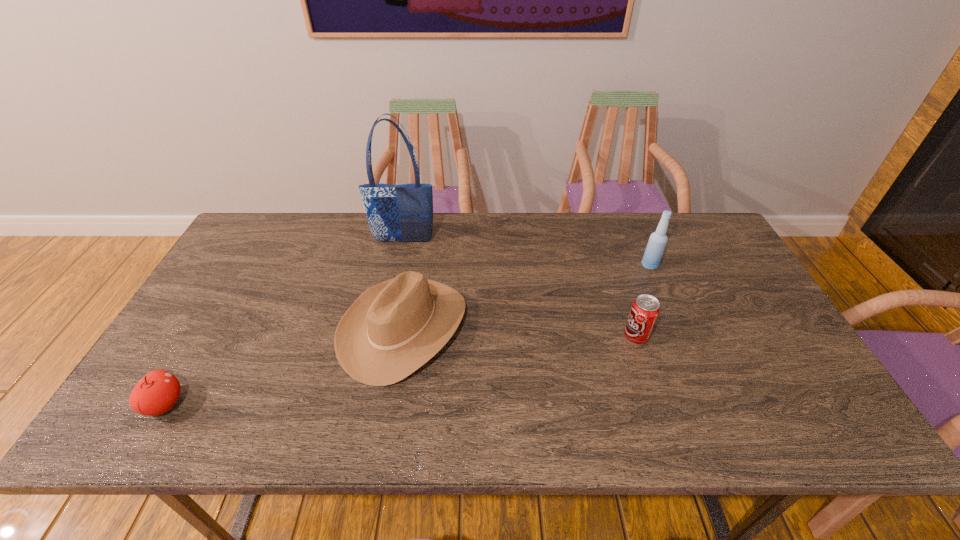
The width and height of the screenshot is (960, 540). Identify the location of vacant area situated on the left of the cowboy hat. (248, 327).

This screenshot has height=540, width=960. Find the location of `vacant space located 0.130m on the left of the soda`. vacant space located 0.130m on the left of the soda is located at coordinates (573, 336).

You are a GUI agent. You are given a task and a screenshot of the screen. Output one action in this format:
    pyautogui.click(x=<x>, y=<y>)
    Task: Click on the vacant space positioned on the back of the apple
    This screenshot has width=960, height=540.
    Given the screenshot: What is the action you would take?
    pyautogui.click(x=188, y=365)

The width and height of the screenshot is (960, 540). What are the coordinates of `object at the far edge` in the screenshot? It's located at (396, 213).

Where is `object that is at the near edge`? The height and width of the screenshot is (540, 960). object that is at the near edge is located at coordinates (157, 392).

This screenshot has width=960, height=540. Identify the location of object located in the left edge section of the desktop. (157, 392).

Identify the location of object located at the near left corner. (157, 392).

Identify the location of vacant space at the far edge of the desktop. tap(648, 234).

Where is `free space at the near edge of the desktop`? free space at the near edge of the desktop is located at coordinates (435, 437).

In the image, there is a desktop. At what (x,y) coordinates should I click in order to perform the action: click on vacant space at the left edge. Please return your answer as a coordinate pair (x, y). Looking at the image, I should click on (223, 339).